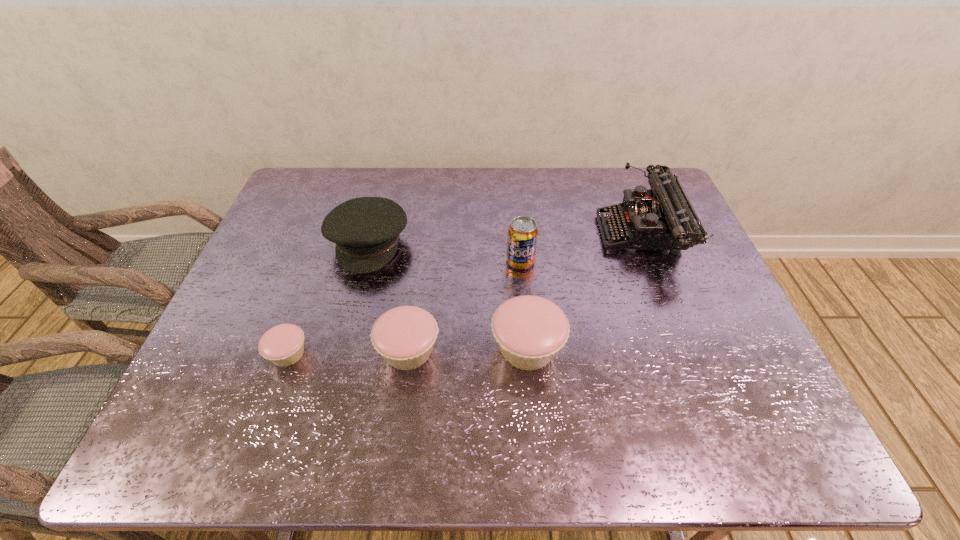
Where is `free region that satisfies the following two spatial constraints: 1. on the front-facing side of the beret; 2. on the right side of the second shortest cupcake`? This screenshot has width=960, height=540. free region that satisfies the following two spatial constraints: 1. on the front-facing side of the beret; 2. on the right side of the second shortest cupcake is located at coordinates (341, 350).

Where is `vacant region that satisfies the following two spatial constraints: 1. on the front-facing side of the beret; 2. on the right side of the second shortest cupcake`? vacant region that satisfies the following two spatial constraints: 1. on the front-facing side of the beret; 2. on the right side of the second shortest cupcake is located at coordinates (341, 350).